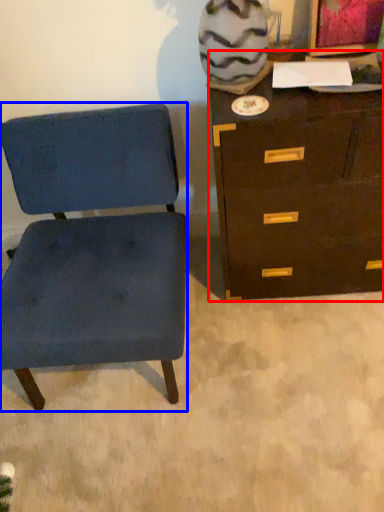
Question: Which of the following is the closest to the observer, chest of drawers (highlighted by a red box) or chair (highlighted by a blue box)?

Choices:
 (A) chest of drawers
 (B) chair

Answer: (B)